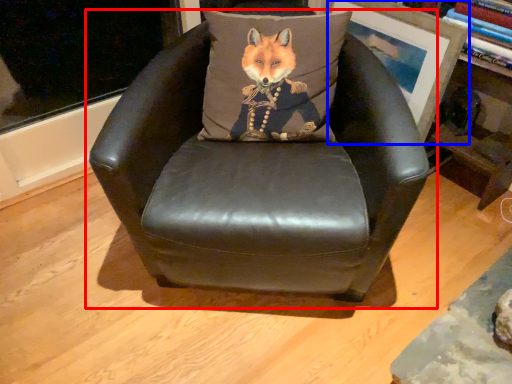
Question: Which of the following is the closest to the observer, chair (highlighted by a red box) or picture frame (highlighted by a blue box)?

Choices:
 (A) chair
 (B) picture frame

Answer: (A)